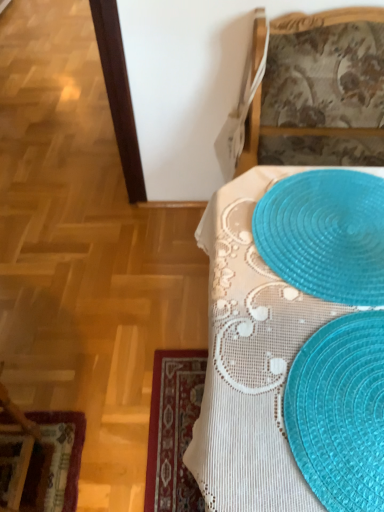
Image resolution: width=384 pixels, height=512 pixels. What are the coordinates of `free spot above translucent plastic placemat at upper right (from a real-world perspective)` in the screenshot? It's located at (329, 214).